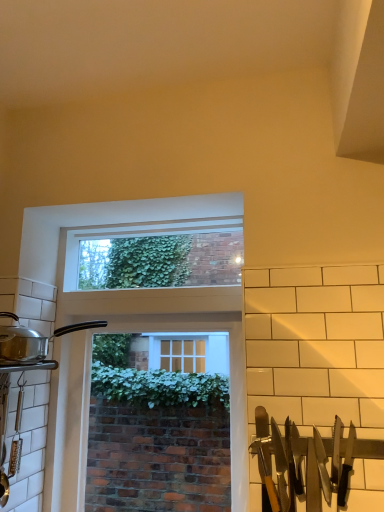
Question: Which direction should I rotate to look at clear glass window at center, the first window screen from the bottom?

Choices:
 (A) left
 (B) right

Answer: (A)

Question: Is silver metallic pot at left wider than clear glass window at upper center, which appears as the 1th window screen when viewed from the top?

Choices:
 (A) no
 (B) yes

Answer: (B)

Question: Does silver metallic pot at left have a lesser height compared to clear glass window at upper center, acting as the 2th window screen starting from the bottom?

Choices:
 (A) no
 (B) yes

Answer: (B)

Question: Could you tell me if silver metallic pot at left is facing clear glass window at upper center, acting as the 2th window screen starting from the bottom?

Choices:
 (A) no
 (B) yes

Answer: (A)

Question: Can you confirm if silver metallic pot at left is bigger than clear glass window at upper center, which appears as the 1th window screen when viewed from the top?

Choices:
 (A) no
 (B) yes

Answer: (A)

Question: From the image's perspective, is silver metallic pot at left located beneath clear glass window at upper center, acting as the 2th window screen starting from the bottom?

Choices:
 (A) no
 (B) yes

Answer: (B)

Question: Is silver metallic pot at left not close to clear glass window at upper center, which appears as the 1th window screen when viewed from the top?

Choices:
 (A) no
 (B) yes

Answer: (A)

Question: Is clear glass window at center, the 2th window screen viewed from the top, smaller than silver metallic pot at left?

Choices:
 (A) yes
 (B) no

Answer: (B)

Question: From a real-world perspective, is clear glass window at center, the first window screen from the bottom, positioned over silver metallic pot at left based on gravity?

Choices:
 (A) no
 (B) yes

Answer: (A)

Question: Considering the relative positions of clear glass window at center, the first window screen from the bottom, and silver metallic pot at left in the image provided, is clear glass window at center, the first window screen from the bottom, to the left of silver metallic pot at left from the viewer's perspective?

Choices:
 (A) no
 (B) yes

Answer: (A)

Question: Is clear glass window at center, the first window screen from the bottom, positioned beyond the bounds of silver metallic pot at left?

Choices:
 (A) yes
 (B) no

Answer: (A)

Question: From a real-world perspective, is clear glass window at center, the 2th window screen viewed from the top, under silver metallic pot at left?

Choices:
 (A) no
 (B) yes

Answer: (B)

Question: Does clear glass window at center, the first window screen from the bottom, have a larger size compared to silver metallic pot at left?

Choices:
 (A) yes
 (B) no

Answer: (A)

Question: From the image's perspective, is clear glass window at upper center, which appears as the 1th window screen when viewed from the top, on top of silver metallic pot at left?

Choices:
 (A) no
 (B) yes

Answer: (B)